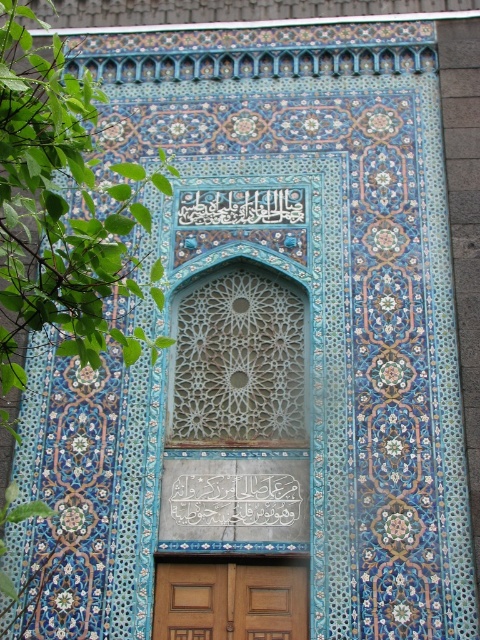
You are standing in front of the architectural facade and want to enter through the wooden panelled door at lower center. Which direction should you walk relative to the white stone writing at center?

You should walk to the right of the white stone writing at center to reach the wooden panelled door at lower center.

You are an architect analyzing the facade of a mosque. You observe the white stone writing at center and the white calligraphy at center. Which of these two elements is taller?

The white stone writing at center is taller than the white calligraphy at center.

You are an architect designing a new building inspired by this facade. You need to ensure that the wooden panelled door at lower center and the white calligraphy at center fit within a specific space. Which object should be placed first to accommodate their sizes?

The wooden panelled door at lower center should be placed first because its width is larger than the white calligraphy at center, ensuring there is enough space allocated for it.